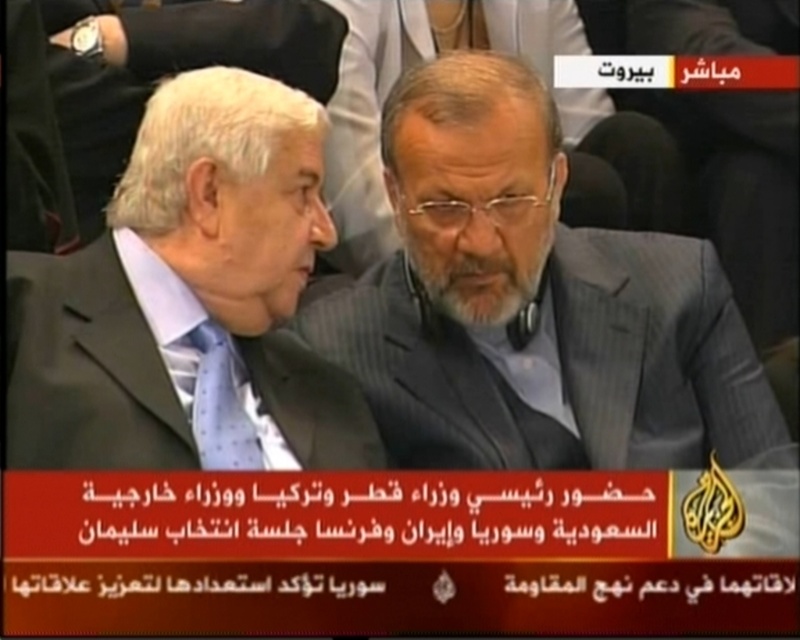
Who is more forward, (432,288) or (108,428)?

Point (108,428)

Can you confirm if gray textured suit at center is bigger than matte black suit at center?

Indeed, gray textured suit at center has a larger size compared to matte black suit at center.

Which is in front, point (360, 314) or point (182, 342)?

Point (182, 342)

Image resolution: width=800 pixels, height=640 pixels. I want to click on gray textured suit at center, so click(x=532, y=301).